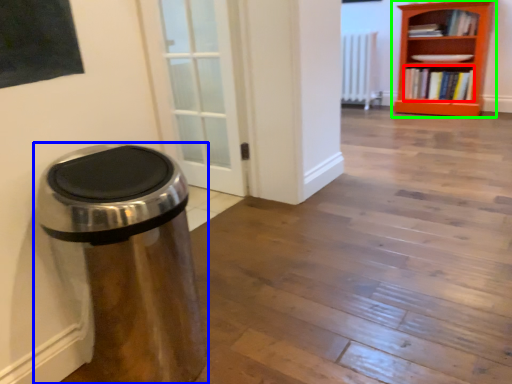
Question: Which object is positioned closest to book (highlighted by a red box)? Select from waste container (highlighted by a blue box) and bookcase (highlighted by a green box).

Choices:
 (A) waste container
 (B) bookcase

Answer: (B)